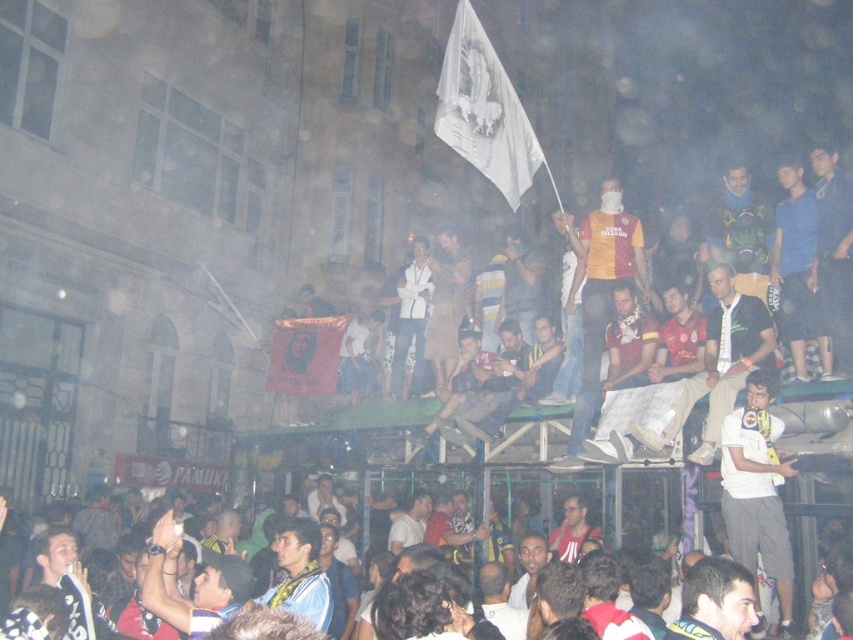
The width and height of the screenshot is (853, 640). Find the location of `white cotton shirt at center`. white cotton shirt at center is located at coordinates (757, 488).

Is white cotton shirt at center above blue fabric shirt at upper right?

Actually, white cotton shirt at center is below blue fabric shirt at upper right.

Find the location of a particular element. The width and height of the screenshot is (853, 640). white cotton shirt at center is located at coordinates (757, 488).

Does blue fabric shirt at upper right have a lesser width compared to white cotton shirt at lower center?

Yes, blue fabric shirt at upper right is thinner than white cotton shirt at lower center.

Locate an element on the screen. blue fabric shirt at upper right is located at coordinates (834, 253).

Identify the location of blue fabric shirt at upper right. Image resolution: width=853 pixels, height=640 pixels. (834, 253).

Who is higher up, dark brown leather jacket at center or red fabric banner at center?

dark brown leather jacket at center is higher up.

The width and height of the screenshot is (853, 640). I want to click on dark brown leather jacket at center, so click(x=720, y=362).

Identify the location of dark brown leather jacket at center. (720, 362).